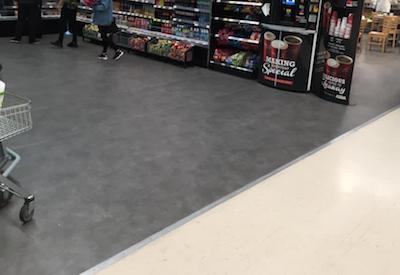
Identify the location of table. (376, 15).